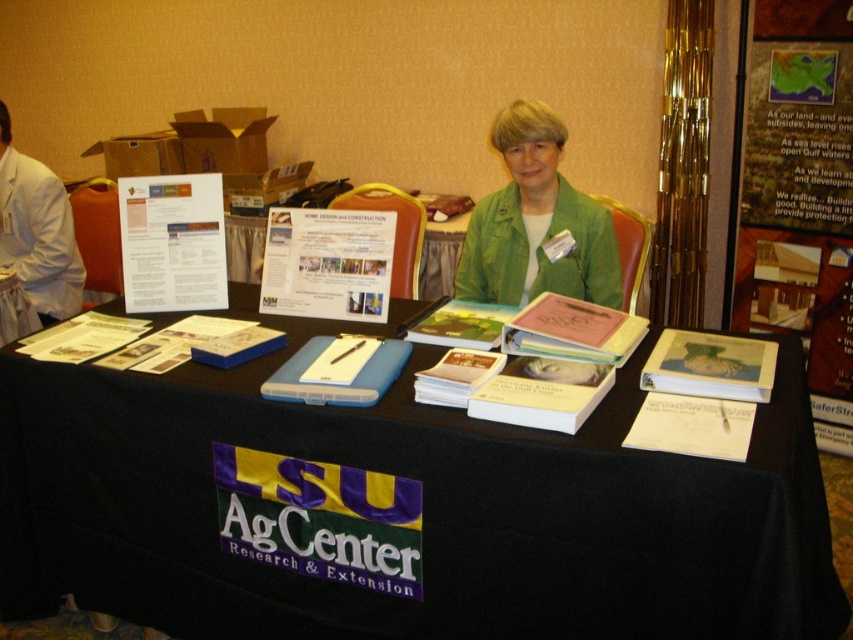
You are an attendee at the LSU AgCenter event and want to place a new folder on the table. The folder is as wide as the matte pink paper at center. Will the black fabric table at center be wide enough to accommodate the folder without it hanging off the edge?

The black fabric table at center is wider than the matte pink paper at center, so the folder, which is as wide as the matte pink paper at center, will fit on the table without hanging off the edge.

You are an attendee at the LSU AgCenter event and want to grab a brochure from the table. The black fabric table at center and the matte pink paper at center are both on the table. Which object is located to the left of the other?

The black fabric table at center is positioned on the left side of matte pink paper at center, so the black fabric table at center is to the left of the matte pink paper at center.